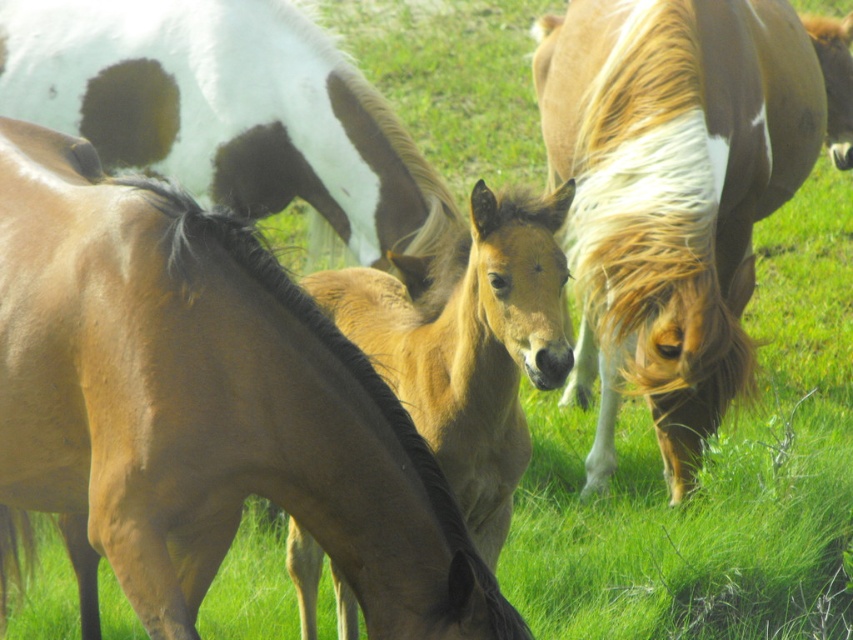
Question: Among these objects, which one is farthest from the camera?

Choices:
 (A) white glossy horse at upper left
 (B) brown glossy horse at center
 (C) light brown glossy horse at center
 (D) light brown glossy foal at center

Answer: (A)

Question: Based on their relative distances, which object is nearer to the white glossy horse at upper left?

Choices:
 (A) light brown glossy horse at center
 (B) light brown glossy foal at center

Answer: (B)

Question: Considering the relative positions of brown glossy horse at center and white glossy horse at upper left in the image provided, where is brown glossy horse at center located with respect to white glossy horse at upper left?

Choices:
 (A) below
 (B) above

Answer: (A)

Question: Is brown glossy horse at center bigger than white glossy horse at upper left?

Choices:
 (A) no
 (B) yes

Answer: (B)

Question: Considering the real-world distances, which object is closest to the light brown glossy foal at center?

Choices:
 (A) white glossy horse at upper left
 (B) brown glossy horse at center

Answer: (B)

Question: Is light brown glossy horse at center thinner than light brown glossy foal at center?

Choices:
 (A) yes
 (B) no

Answer: (B)